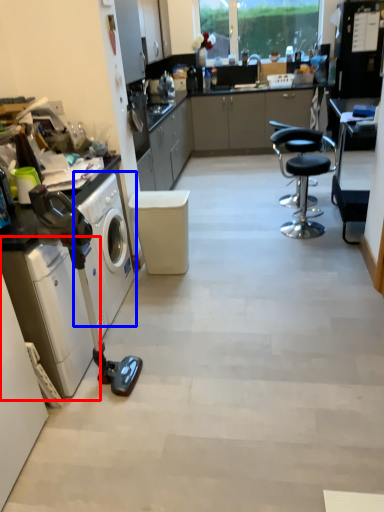
Question: Which of the following is the farthest to the observer, washing machine (highlighted by a red box) or washing machine (highlighted by a blue box)?

Choices:
 (A) washing machine
 (B) washing machine

Answer: (B)